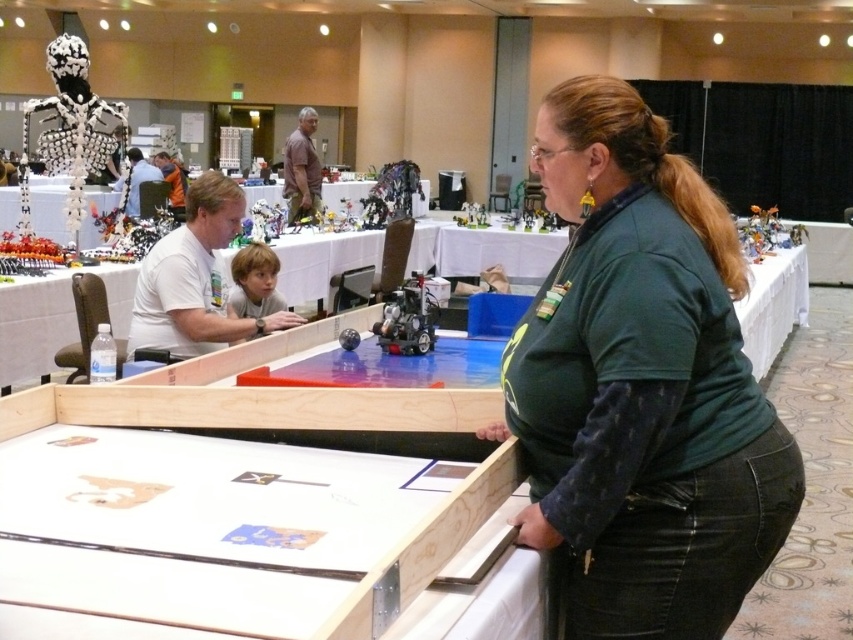
Question: Does green fabric shirt at center come in front of brown shirt at center?

Choices:
 (A) no
 (B) yes

Answer: (B)

Question: Can you confirm if green fabric shirt at center is positioned to the left of brown shirt at center?

Choices:
 (A) yes
 (B) no

Answer: (B)

Question: Among these points, which one is farthest from the camera?

Choices:
 (A) (544, 538)
 (B) (135, 196)

Answer: (B)

Question: Among these objects, which one is nearest to the camera?

Choices:
 (A) brown shirt at center
 (B) white matte shirt at center
 (C) green fabric shirt at center
 (D) matte white hair at upper left

Answer: (C)

Question: Is brown shirt at center above matte white hair at upper left?

Choices:
 (A) yes
 (B) no

Answer: (B)

Question: Which point appears farthest from the camera in this image?

Choices:
 (A) (260, 291)
 (B) (138, 150)

Answer: (B)